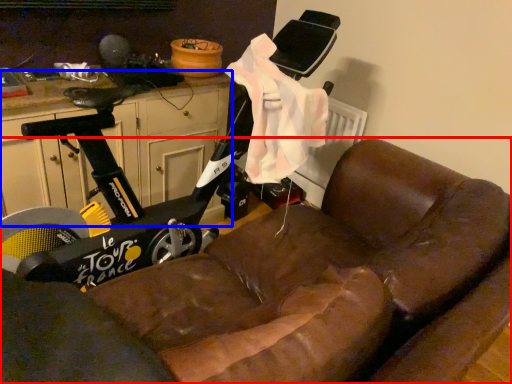
Question: Which point is further to the camera, studio couch (highlighted by a red box) or dresser (highlighted by a blue box)?

Choices:
 (A) studio couch
 (B) dresser

Answer: (B)